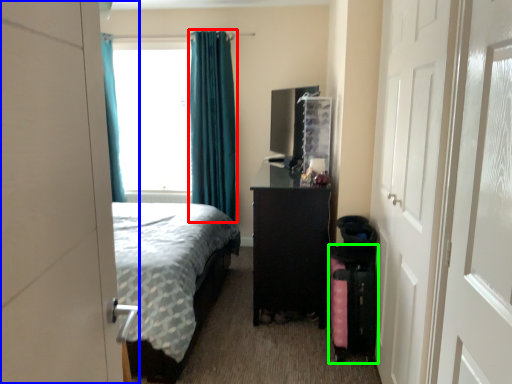
Question: Based on their relative distances, which object is nearer to curtain (highlighted by a red box)? Choose from door (highlighted by a blue box) and luggage (highlighted by a green box).

Choices:
 (A) door
 (B) luggage

Answer: (B)